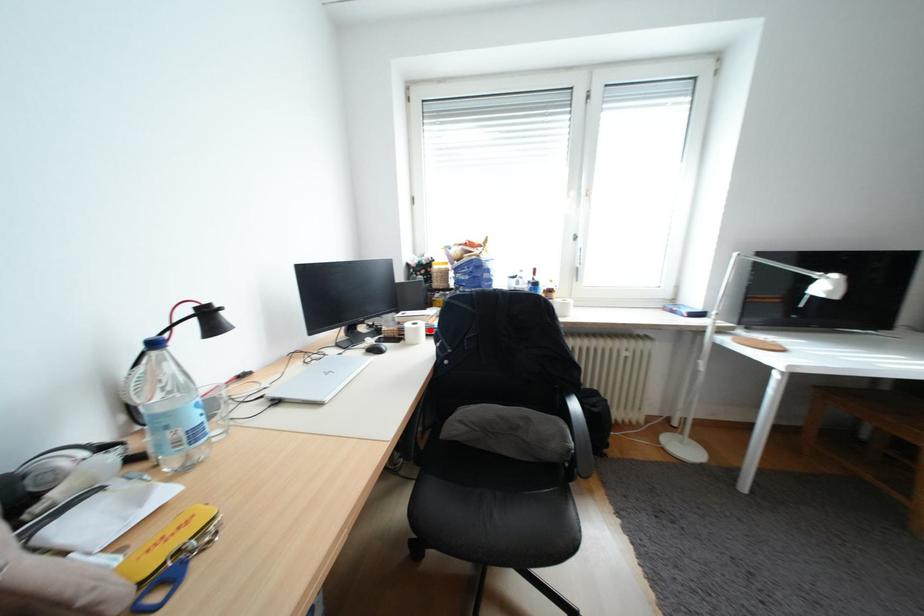
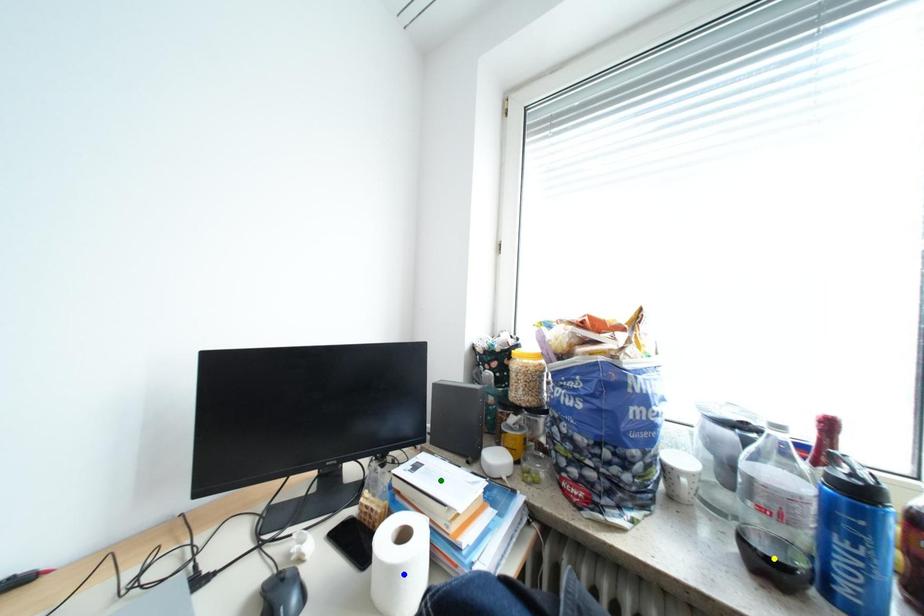
Question: I am providing you with two images of the same scene from different viewpoints. A red point is marked on the first image. You are given multiple points on the second image. Which point in image 2 is actually the same real-world point as the red point in image 1?

Choices:
 (A) blue point
 (B) yellow point
 (C) green point

Answer: (A)